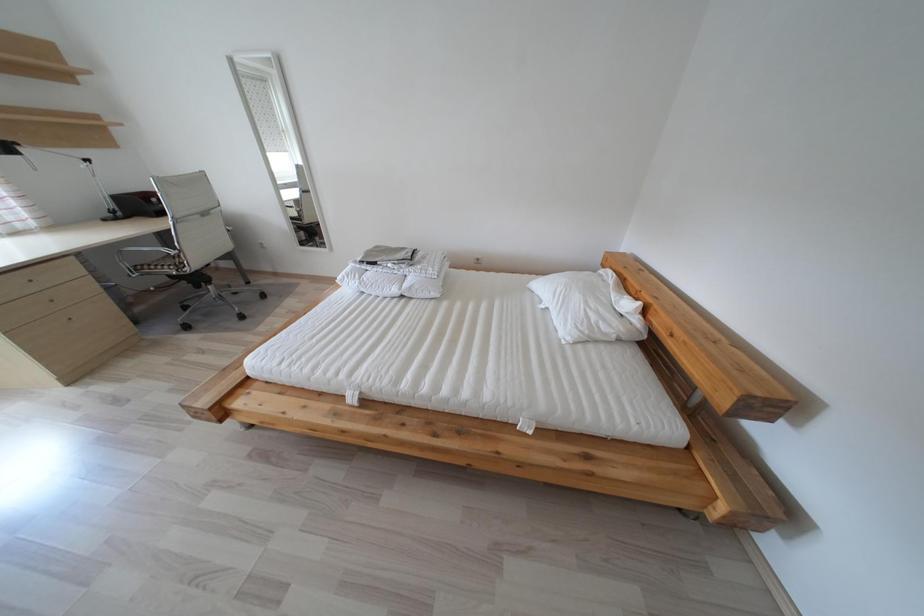
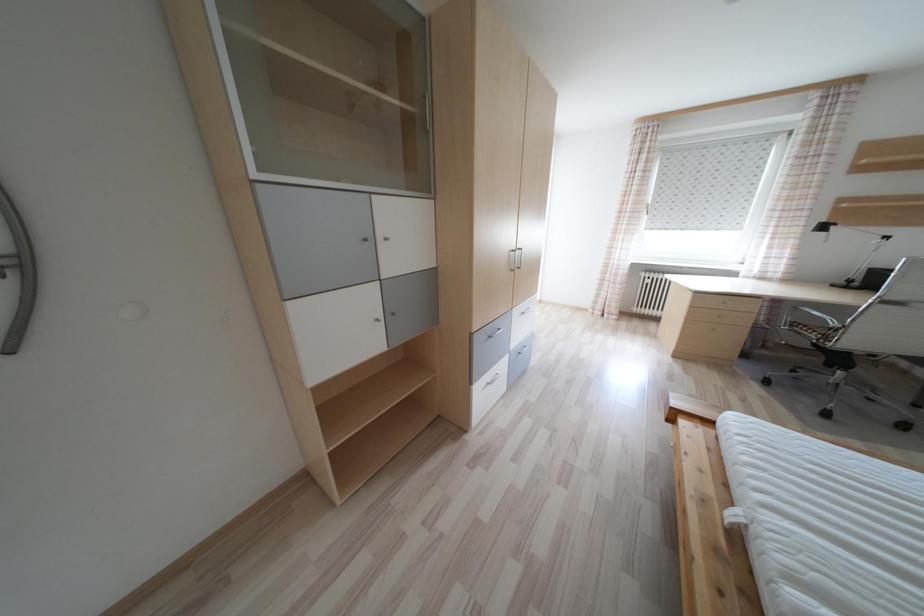
How did the camera likely rotate?

The rotation direction of the camera is left-down.